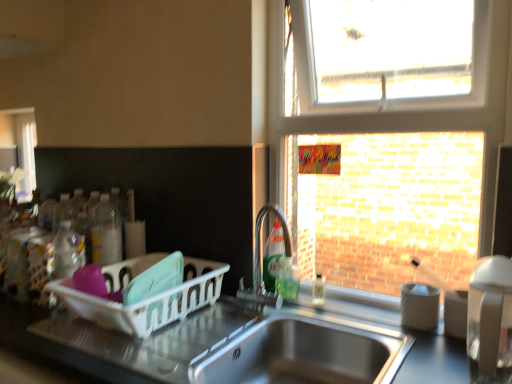
Question: Can you confirm if metallic stainless steel sink at center is positioned to the left of translucent plastic soap dispenser at sink right, which is counted as the 4th bottle, starting from the left?

Choices:
 (A) no
 (B) yes

Answer: (B)

Question: Is metallic stainless steel sink at center directly adjacent to translucent plastic soap dispenser at sink right, which is counted as the 4th bottle, starting from the left?

Choices:
 (A) yes
 (B) no

Answer: (B)

Question: Can you confirm if metallic stainless steel sink at center is wider than translucent plastic soap dispenser at sink right, which is counted as the 4th bottle, starting from the left?

Choices:
 (A) no
 (B) yes

Answer: (B)

Question: Considering the relative sizes of metallic stainless steel sink at center and translucent plastic soap dispenser at sink right, the first bottle when ordered from right to left, in the image provided, is metallic stainless steel sink at center bigger than translucent plastic soap dispenser at sink right, the first bottle when ordered from right to left,?

Choices:
 (A) no
 (B) yes

Answer: (B)

Question: Is metallic stainless steel sink at center smaller than translucent plastic soap dispenser at sink right, which is counted as the 4th bottle, starting from the left?

Choices:
 (A) yes
 (B) no

Answer: (B)

Question: From a real-world perspective, is metallic stainless steel sink at center positioned under translucent plastic soap dispenser at sink right, the first bottle when ordered from right to left, based on gravity?

Choices:
 (A) yes
 (B) no

Answer: (A)

Question: Does stainless steel sink at lower center touch green matte dish soap at center, which is the third bottle from right to left?

Choices:
 (A) no
 (B) yes

Answer: (A)

Question: From a real-world perspective, is stainless steel sink at lower center below green matte dish soap at center, the 2th bottle from the left?

Choices:
 (A) no
 (B) yes

Answer: (B)

Question: Is stainless steel sink at lower center at the right side of green matte dish soap at center, which is the third bottle from right to left?

Choices:
 (A) yes
 (B) no

Answer: (A)

Question: From the image's perspective, is stainless steel sink at lower center beneath green matte dish soap at center, which is the third bottle from right to left?

Choices:
 (A) yes
 (B) no

Answer: (A)

Question: From a real-world perspective, is stainless steel sink at lower center positioned over green matte dish soap at center, the 2th bottle from the left, based on gravity?

Choices:
 (A) no
 (B) yes

Answer: (A)

Question: Is stainless steel sink at lower center wider than green matte dish soap at center, the 2th bottle from the left?

Choices:
 (A) yes
 (B) no

Answer: (A)

Question: From the image's perspective, is stainless steel sink at lower center under green translucent soap dispenser at sink, positioned as the 2th bottle in right-to-left order?

Choices:
 (A) yes
 (B) no

Answer: (A)